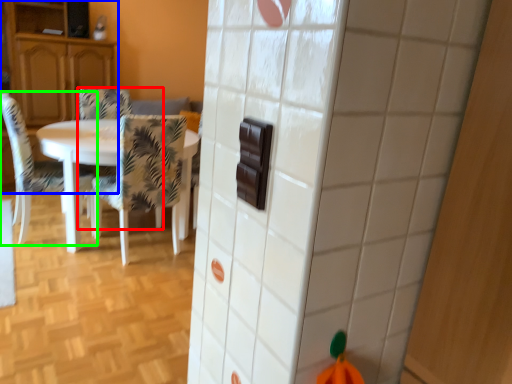
Question: Based on their relative distances, which object is farther from chair (highlighted by a red box)? Choose from cabinetry (highlighted by a blue box) and chair (highlighted by a green box).

Choices:
 (A) cabinetry
 (B) chair

Answer: (B)